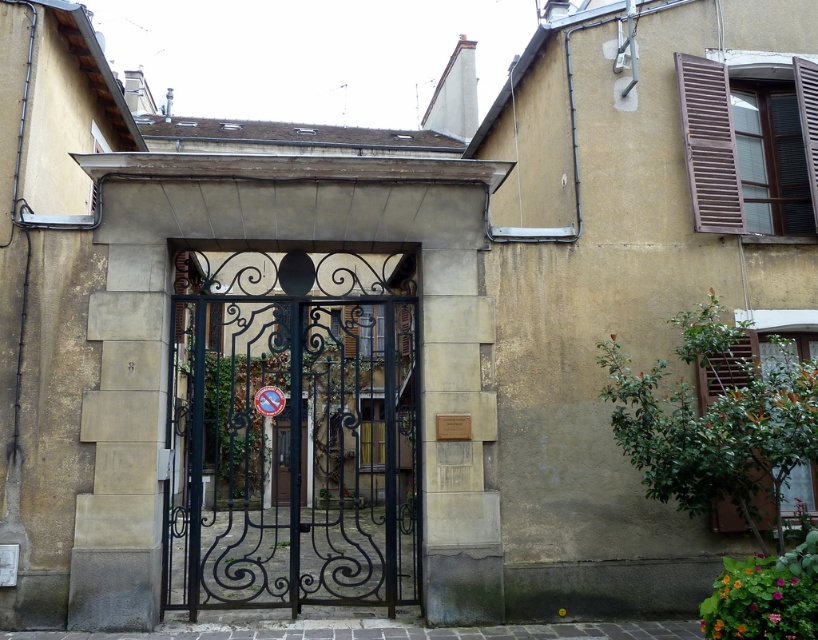
You are standing in front of the residential building and need to locate the entrance. Based on the image, where is the black wrought iron gate at center positioned relative to the entrance?

The black wrought iron gate at center is located at the entrance of the residential building, as it is positioned at the center and marked as the main feature in the scene description.

You are a delivery person approaching the black wrought iron gate at center and the brown wooden shutters at upper right. Which object is nearer to you as you stand at the entrance?

The black wrought iron gate at center is closer to the viewer than the brown wooden shutters at upper right, so the black wrought iron gate at center is nearer to you as you stand at the entrance.